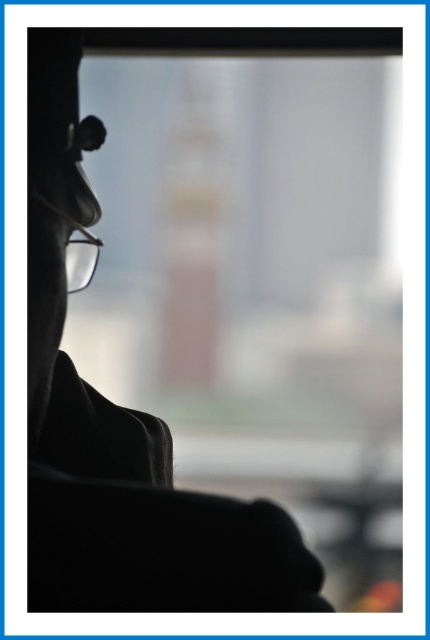
You are taking a photo of the person in the image. You want to focus on the point that is closer to the camera. Which point should you choose between point (316, 593) and point (68, 273)?

Point (316, 593) is closer to the camera than point (68, 273), so you should focus on point (316, 593).

You are a photographer trying to adjust the focus of your camera. You notice the silhouette coat at left and the transparent plastic glasses at left in your frame. Which object should you focus on first if you want both to be in focus?

The silhouette coat at left is in front of the transparent plastic glasses at left, so you should focus on the transparent plastic glasses at left first to ensure both are in focus.

You are a photographer adjusting the focus on your camera. You want to ensure both the silhouette coat at left and the transparent plastic glasses at left are in focus. Given that the depth of field can cover 2 inches, will both objects be in focus?

The silhouette coat at left is 1.83 inches from transparent plastic glasses at left. Since the depth of field can cover 2 inches, both objects will be in focus as the distance between them is within the depth of field range.